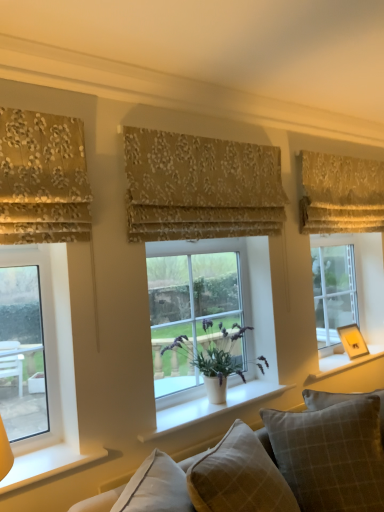
Locate an element on the screen. empty space that is ontop of gold floral fabric at upper left, marked as the first curtain in a left-to-right arrangement (from a real-world perspective) is located at coordinates (37, 109).